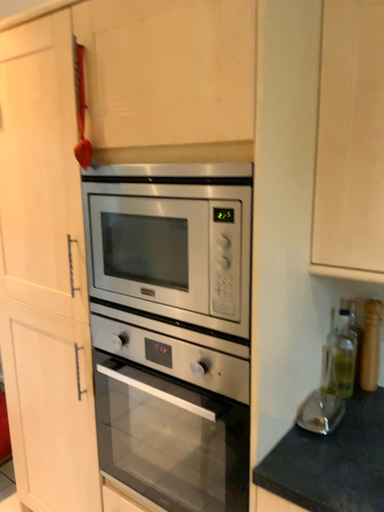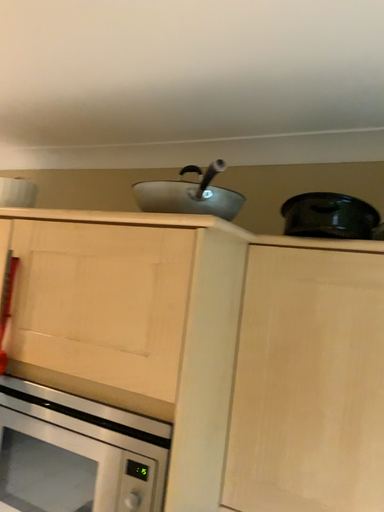
Question: How did the camera likely rotate when shooting the video?

Choices:
 (A) rotated upward
 (B) rotated downward

Answer: (A)